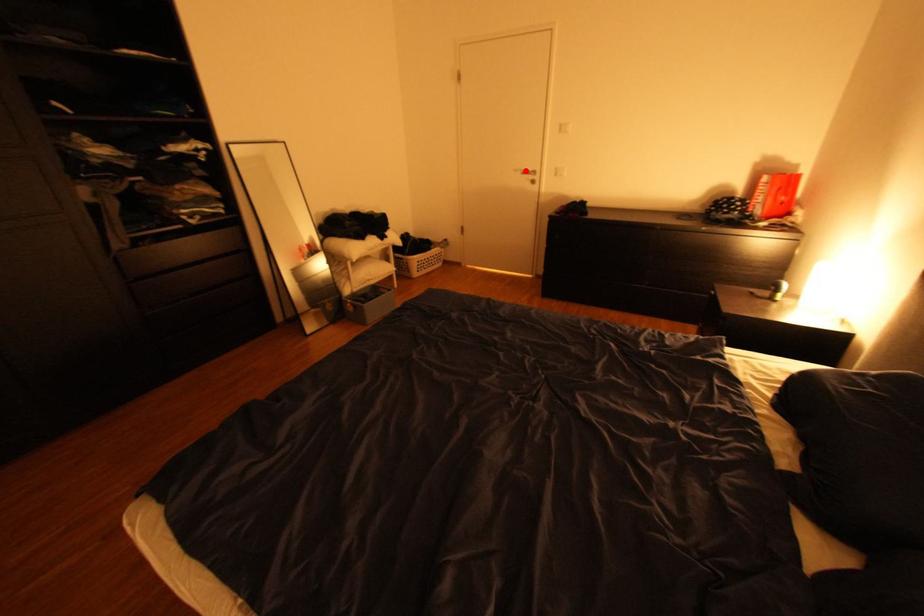
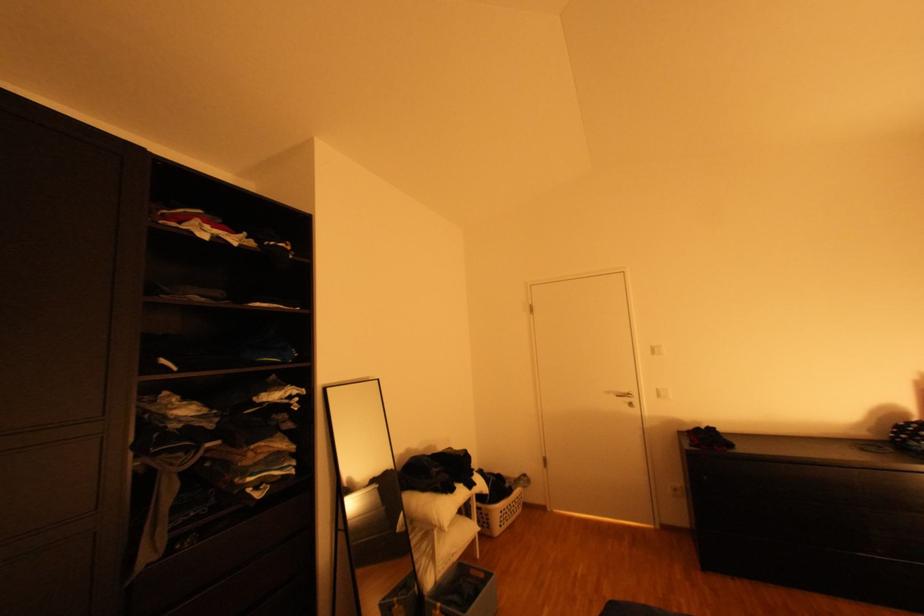
Question: I am providing you with two images of the same scene from different viewpoints. A red point is marked on the first image. Can you still see the location of the red point in image 2?

Choices:
 (A) Yes
 (B) No

Answer: (A)